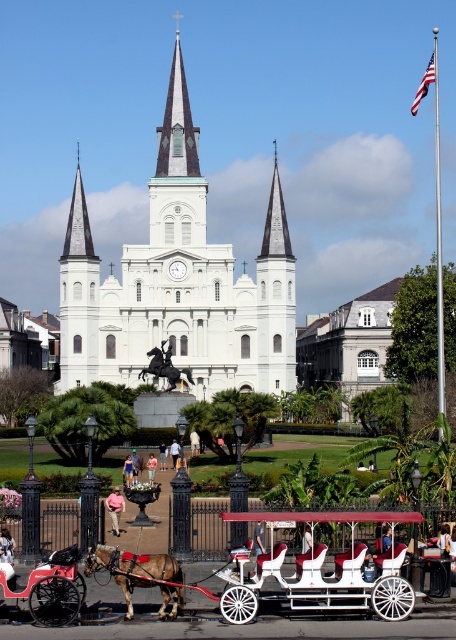
Between white stone church at center and brown glossy horse at lower left, which one has more height?

white stone church at center

The image size is (456, 640). What do you see at coordinates (179, 282) in the screenshot?
I see `white stone church at center` at bounding box center [179, 282].

Image resolution: width=456 pixels, height=640 pixels. What are the coordinates of `white stone church at center` in the screenshot? It's located at (179, 282).

Is polished wood horse cart at lower left wider than shiny black horse at center?

Correct, the width of polished wood horse cart at lower left exceeds that of shiny black horse at center.

Is polished wood horse cart at lower left taller than shiny black horse at center?

Yes.

This screenshot has width=456, height=640. What do you see at coordinates (50, 588) in the screenshot?
I see `polished wood horse cart at lower left` at bounding box center [50, 588].

Locate an element on the screen. polished wood horse cart at lower left is located at coordinates (50, 588).

Who is positioned more to the left, white stone church at center or white wood wagon at center?

white stone church at center

Who is shorter, white stone church at center or white wood wagon at center?

Standing shorter between the two is white wood wagon at center.

Which is in front, point (79, 237) or point (321, 561)?

Point (321, 561) is more forward.

Locate an element on the screen. white stone church at center is located at coordinates (179, 282).